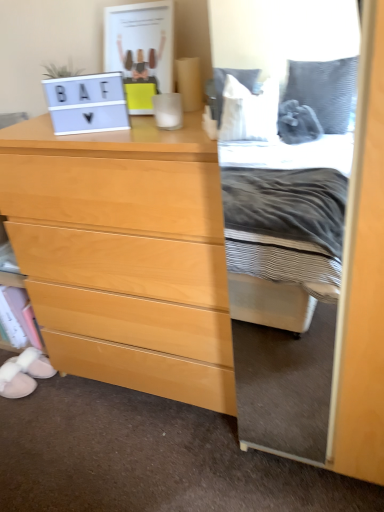
Locate an element on the screen. The height and width of the screenshot is (512, 384). free point to the right of matte white laptop at upper left is located at coordinates (140, 123).